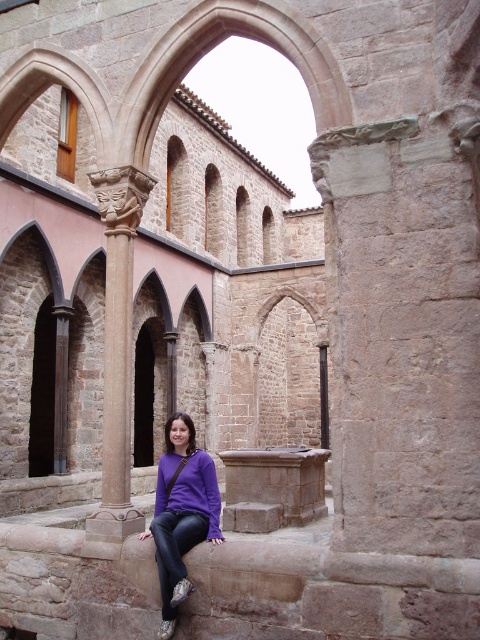
Who is more distant from viewer, (176, 460) or (206, 538)?

Point (176, 460)

Does purple matte sweater at center appear on the right side of purple matte sweatshirt at lower center?

Incorrect, purple matte sweater at center is not on the right side of purple matte sweatshirt at lower center.

Is point (186, 540) positioned before point (162, 460)?

Yes.

Find the location of `purple matte sweater at center`. purple matte sweater at center is located at coordinates (181, 513).

Is brown stone column at left smaller than purple matte sweater at center?

No, brown stone column at left is not smaller than purple matte sweater at center.

Is brown stone column at left to the left of purple matte sweater at center from the viewer's perspective?

Indeed, brown stone column at left is positioned on the left side of purple matte sweater at center.

Is point (130, 353) farther from viewer compared to point (167, 433)?

No, it is in front of (167, 433).

The width and height of the screenshot is (480, 640). Identify the location of brown stone column at left. (117, 355).

Does brown stone column at left have a greater width compared to purple matte sweatshirt at lower center?

Yes, brown stone column at left is wider than purple matte sweatshirt at lower center.

Who is more forward, (127, 288) or (171, 506)?

Positioned in front is point (171, 506).

Where is `brown stone column at left`? The width and height of the screenshot is (480, 640). brown stone column at left is located at coordinates (117, 355).